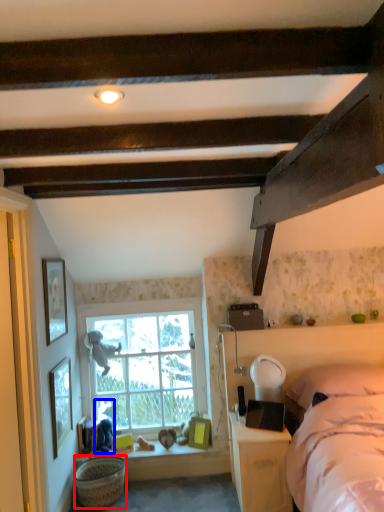
Question: Among these objects, which one is nearest to the camera, basket (highlighted by a red box) or person (highlighted by a blue box)?

Choices:
 (A) basket
 (B) person

Answer: (A)